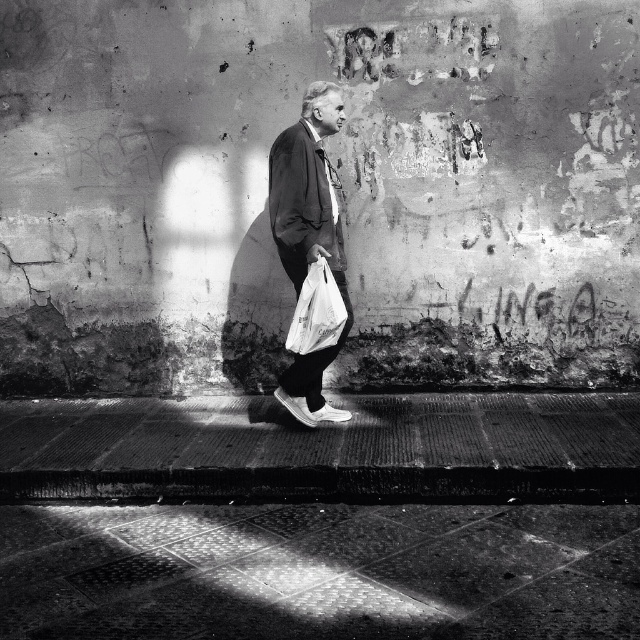
Question: Does polished stone pavement at lower center lie in front of matte black jacket at center?

Choices:
 (A) yes
 (B) no

Answer: (A)

Question: Which object is positioned closest to the white plastic bag at lower center?

Choices:
 (A) polished stone pavement at lower center
 (B) matte black jacket at center

Answer: (B)

Question: Among these objects, which one is farthest from the camera?

Choices:
 (A) matte black jacket at center
 (B) polished stone pavement at lower center

Answer: (A)

Question: Can you confirm if polished stone pavement at lower center is positioned to the right of matte black jacket at center?

Choices:
 (A) yes
 (B) no

Answer: (B)

Question: Is polished stone pavement at lower center wider than white plastic bag at lower center?

Choices:
 (A) no
 (B) yes

Answer: (B)

Question: Which point is farther to the camera?

Choices:
 (A) (328, 88)
 (B) (198, 552)

Answer: (A)